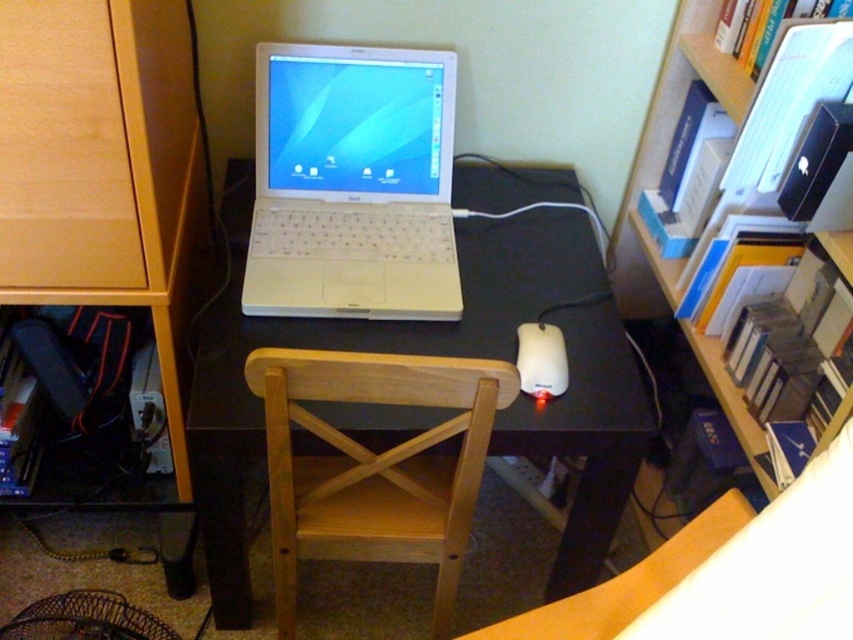
Question: Which object appears closest to the camera in this image?

Choices:
 (A) matte wood drawer at left
 (B) white plastic laptop at center
 (C) light wood chair at center

Answer: (A)

Question: Is light wood chair at center in front of matte wood drawer at left?

Choices:
 (A) yes
 (B) no

Answer: (B)

Question: Among these objects, which one is farthest from the camera?

Choices:
 (A) white plastic laptop at center
 (B) black matte computer desk at center
 (C) light wood chair at center

Answer: (A)

Question: Does white plastic laptop at center have a smaller size compared to wooden bookshelf at upper right?

Choices:
 (A) yes
 (B) no

Answer: (A)

Question: Which point is farther from the camera taking this photo?

Choices:
 (A) (79, 195)
 (B) (553, 385)
 (C) (404, 349)
 (D) (695, 340)

Answer: (D)

Question: Does black matte computer desk at center lie behind light wood chair at center?

Choices:
 (A) no
 (B) yes

Answer: (B)